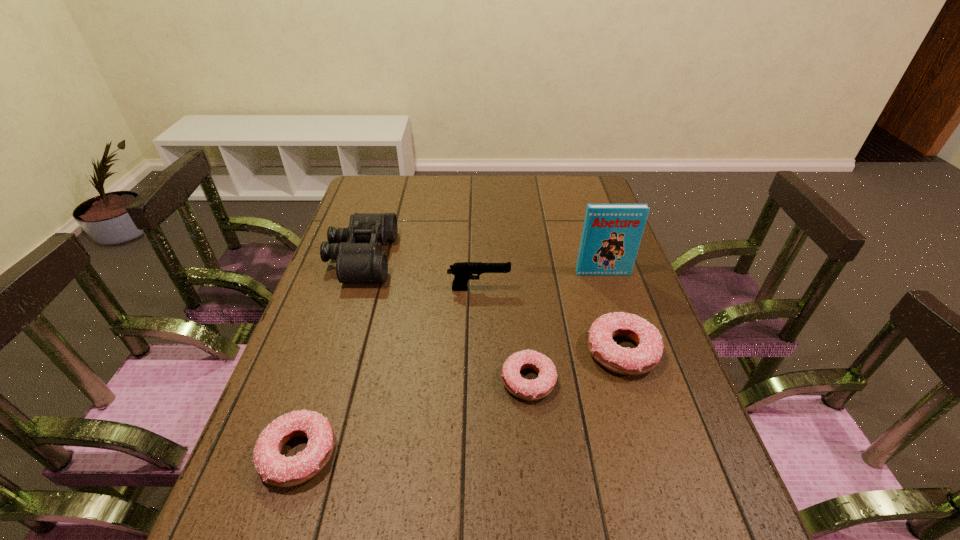
Image resolution: width=960 pixels, height=540 pixels. I want to click on vacant spot for a new doughnut to ensure equal spacing, so click(x=421, y=415).